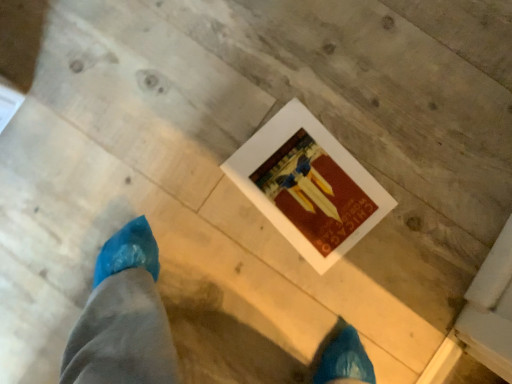
Locate an element on the screen. This screenshot has width=512, height=384. free region under matte paper postcard at center (from a real-world perspective) is located at coordinates (308, 191).